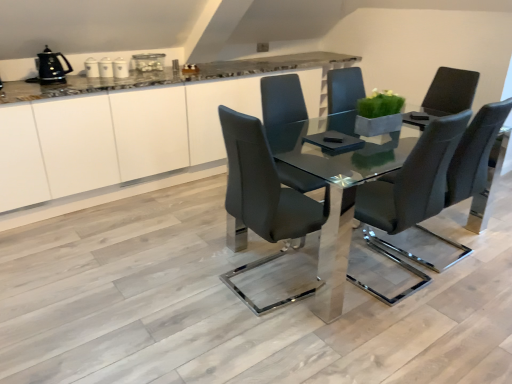
The width and height of the screenshot is (512, 384). In order to click on free space on the front side of matte black chair at center, which ranks as the 2th chair in right-to-left order in this screenshot , I will do tap(273, 341).